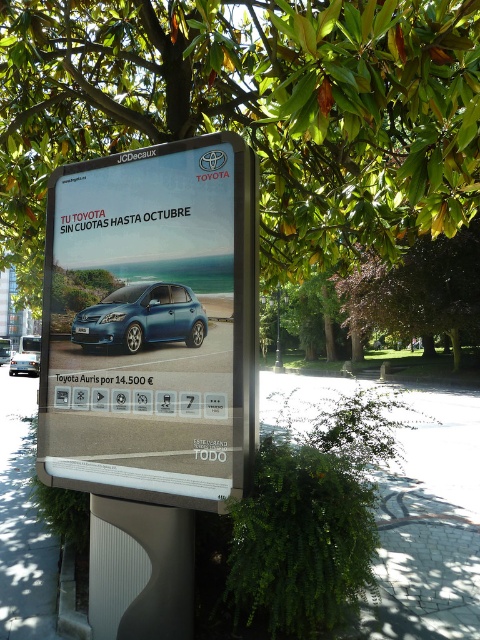
Question: Does green leafy tree at center have a smaller size compared to satin blue car at center?

Choices:
 (A) no
 (B) yes

Answer: (A)

Question: Considering the real-world distances, which object is closest to the paved stone at lower center?

Choices:
 (A) satin blue car at center
 (B) metallic blue car at center

Answer: (B)

Question: Is metallic blue car at center to the left of metallic blue hatchback at center from the viewer's perspective?

Choices:
 (A) no
 (B) yes

Answer: (A)

Question: Where is green leafy tree at center located in relation to satin blue car at center in the image?

Choices:
 (A) right
 (B) left

Answer: (A)

Question: Which point appears closest to the camera in this image?

Choices:
 (A) (464, 228)
 (B) (168, 448)

Answer: (B)

Question: Which point is closer to the camera?

Choices:
 (A) (36, 371)
 (B) (160, 314)
 (C) (428, 500)

Answer: (B)